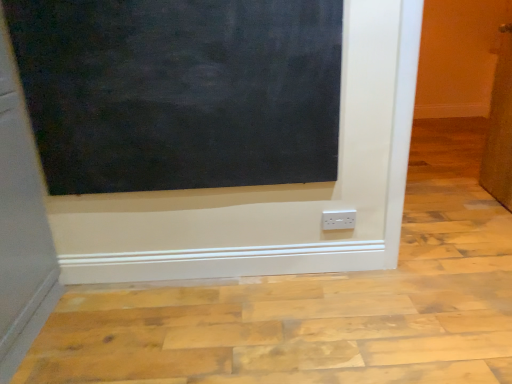
At what (x,y) coordinates should I click in order to perform the action: click on free point behind brown textured door at right. Please return your answer as a coordinate pair (x, y). This screenshot has height=384, width=512. Looking at the image, I should click on (451, 181).